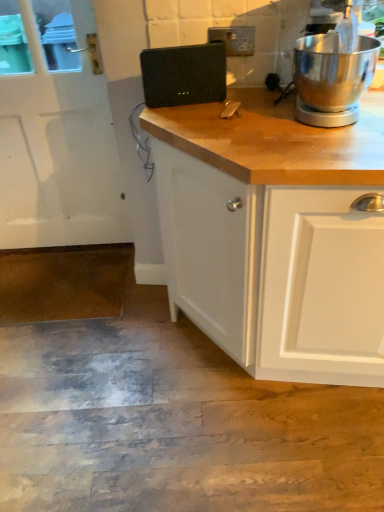
Question: Is white matte screen door at left placed right next to black plastic speaker at center?

Choices:
 (A) yes
 (B) no

Answer: (B)

Question: Is black plastic speaker at center at the back of white matte screen door at left?

Choices:
 (A) no
 (B) yes

Answer: (A)

Question: Is white matte screen door at left bigger than black plastic speaker at center?

Choices:
 (A) no
 (B) yes

Answer: (B)

Question: Does white matte screen door at left appear on the left side of black plastic speaker at center?

Choices:
 (A) no
 (B) yes

Answer: (B)

Question: Considering the relative sizes of white matte screen door at left and black plastic speaker at center in the image provided, is white matte screen door at left wider than black plastic speaker at center?

Choices:
 (A) no
 (B) yes

Answer: (B)

Question: From a real-world perspective, is white matte screen door at left positioned under black plastic speaker at center based on gravity?

Choices:
 (A) no
 (B) yes

Answer: (B)

Question: Would you say polished stainless steel stand mixer at upper right contains white matte screen door at left?

Choices:
 (A) no
 (B) yes

Answer: (A)

Question: Is polished stainless steel stand mixer at upper right to the right of white matte screen door at left from the viewer's perspective?

Choices:
 (A) no
 (B) yes

Answer: (B)

Question: Considering the relative sizes of polished stainless steel stand mixer at upper right and white matte screen door at left in the image provided, is polished stainless steel stand mixer at upper right shorter than white matte screen door at left?

Choices:
 (A) yes
 (B) no

Answer: (A)

Question: Does polished stainless steel stand mixer at upper right come behind white matte screen door at left?

Choices:
 (A) yes
 (B) no

Answer: (B)

Question: From the image's perspective, is polished stainless steel stand mixer at upper right located above white matte screen door at left?

Choices:
 (A) no
 (B) yes

Answer: (B)

Question: Can you confirm if polished stainless steel stand mixer at upper right is smaller than white matte screen door at left?

Choices:
 (A) yes
 (B) no

Answer: (A)

Question: From the image's perspective, is black plastic speaker at center beneath white matte screen door at left?

Choices:
 (A) no
 (B) yes

Answer: (A)